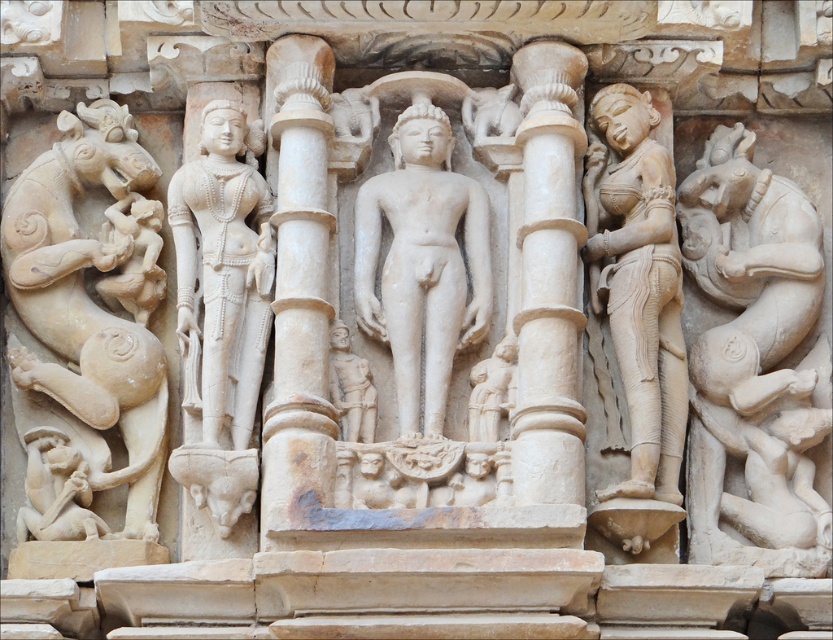
Is smooth beige statue at right wider than white marble statue at left?

Yes, smooth beige statue at right is wider than white marble statue at left.

Who is positioned more to the right, smooth beige statue at right or white marble statue at left?

Positioned to the right is smooth beige statue at right.

The height and width of the screenshot is (640, 833). What do you see at coordinates (637, 284) in the screenshot?
I see `smooth beige statue at right` at bounding box center [637, 284].

Locate an element on the screen. smooth beige statue at right is located at coordinates (637, 284).

Between point (831, 509) and point (298, 256), which one is positioned in front?

Point (298, 256) is in front.

What do you see at coordinates (756, 365) in the screenshot?
I see `white stone elephant at right` at bounding box center [756, 365].

Locate an element on the screen. The height and width of the screenshot is (640, 833). white stone elephant at right is located at coordinates (756, 365).

Is white stone elephant at right taller than smooth beige statue at right?

Correct, white stone elephant at right is much taller as smooth beige statue at right.

Can you confirm if white stone elephant at right is wider than smooth beige statue at right?

Indeed, white stone elephant at right has a greater width compared to smooth beige statue at right.

Describe the element at coordinates (756, 365) in the screenshot. I see `white stone elephant at right` at that location.

This screenshot has height=640, width=833. I want to click on white stone elephant at right, so click(x=756, y=365).